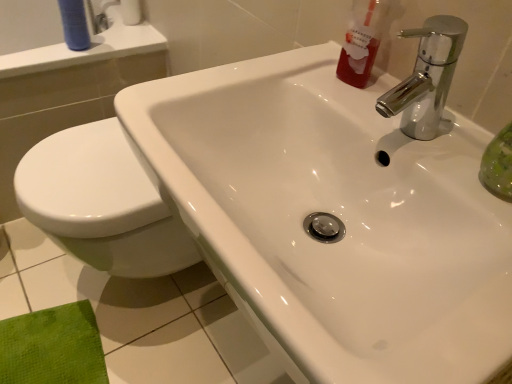
In order to click on free space behind chrome metallic faucet at upper right in this screenshot , I will do `click(355, 96)`.